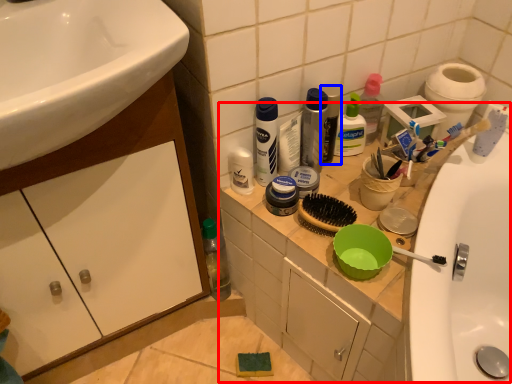
Question: Which object appears closest to the camera in this image, counter (highlighted by a red box) or mouthwash (highlighted by a blue box)?

Choices:
 (A) counter
 (B) mouthwash

Answer: (A)